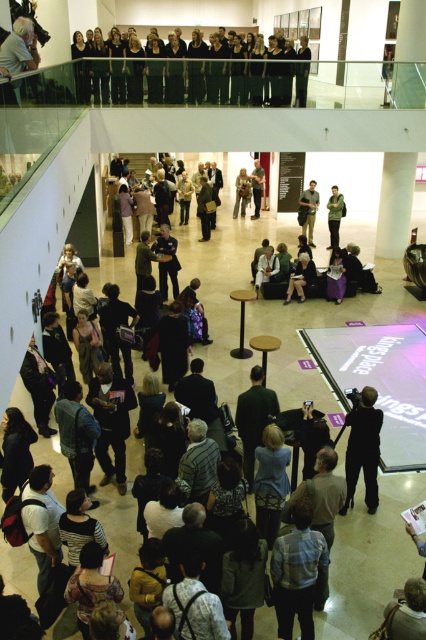
Between dark gray suit at center and green matte jacket at center, which one appears on the left side from the viewer's perspective?

dark gray suit at center

Is point (347, 464) in front of point (344, 204)?

Yes, point (347, 464) is closer to viewer.

The height and width of the screenshot is (640, 426). I want to click on dark gray suit at center, so click(x=362, y=449).

Does point (245, 189) come closer to viewer compared to point (253, 180)?

Yes.

Which is above, light brown fabric jacket at center or light brown leather jacket at center?

light brown leather jacket at center is above.

Does point (245, 182) come in front of point (261, 180)?

Yes.

Where is `light brown fabric jacket at center`? The height and width of the screenshot is (640, 426). light brown fabric jacket at center is located at coordinates [x=241, y=193].

Find the location of a particular element. Image resolution: width=426 pixels, height=640 pixels. black fabric crowd at upper center is located at coordinates (189, 74).

Does black fabric crowd at upper center have a smaller size compared to green matte jacket at center?

Correct, black fabric crowd at upper center occupies less space than green matte jacket at center.

Locate an element on the screen. Image resolution: width=426 pixels, height=640 pixels. black fabric crowd at upper center is located at coordinates (189, 74).

Find the location of a particular element. The width and height of the screenshot is (426, 640). black fabric crowd at upper center is located at coordinates (189, 74).